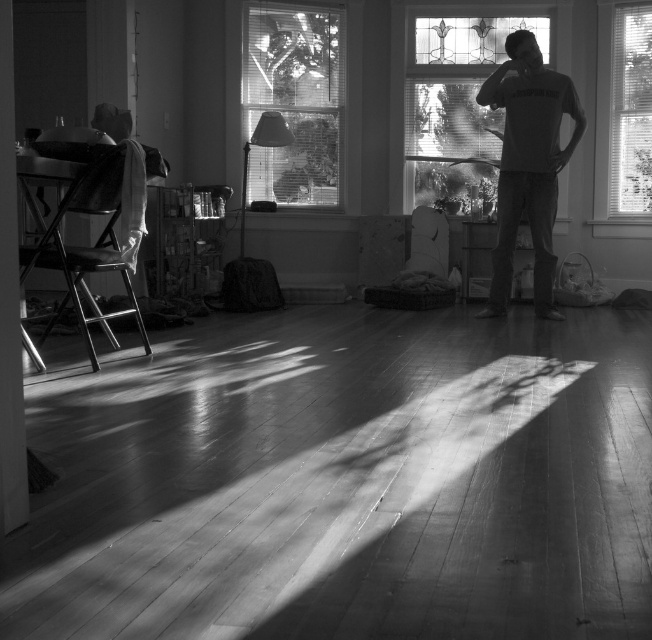
Who is shorter, clear glass window at upper center or gray cotton shirt at center?

clear glass window at upper center is shorter.

Locate an element on the screen. The width and height of the screenshot is (652, 640). clear glass window at upper center is located at coordinates tap(452, 93).

Locate an element on the screen. Image resolution: width=652 pixels, height=640 pixels. gray cotton shirt at center is located at coordinates (527, 163).

Is point (505, 276) farther from viewer compared to point (630, 152)?

No, it is in front of (630, 152).

Does point (561, 150) lie in front of point (645, 102)?

That is True.

At what (x,y) coordinates should I click in order to perform the action: click on gray cotton shirt at center. Please return your answer as a coordinate pair (x, y). This screenshot has width=652, height=640. Looking at the image, I should click on (527, 163).

Is clear glass window at upper center to the left of transparent glass window at right from the viewer's perspective?

Correct, you'll find clear glass window at upper center to the left of transparent glass window at right.

Is clear glass window at upper center taller than transparent glass window at right?

No.

Image resolution: width=652 pixels, height=640 pixels. What do you see at coordinates (452, 93) in the screenshot? I see `clear glass window at upper center` at bounding box center [452, 93].

Where is `clear glass window at upper center`? Image resolution: width=652 pixels, height=640 pixels. clear glass window at upper center is located at coordinates (452, 93).